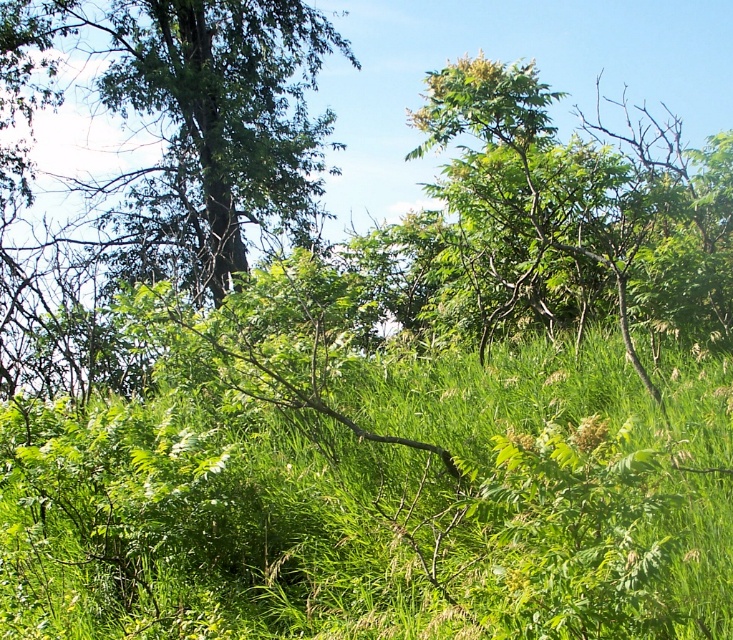
You are standing in a natural area with tall grasses and shrubs. You see a point marked at coordinates (377, 508). What is located at that point?

The point at (377, 508) is occupied by green leafy grass at center.

You are a gardener who wants to plant a new flower bed in the area shown in the image. The flower bed requires plants that are shorter than the existing green leafy tree at upper left. Can the green leafy grass at center be used for this flower bed?

The green leafy grass at center is much taller than the green leafy tree at upper left, so it cannot be used for the flower bed which requires plants shorter than the tree.

You are a hiker who wants to take a photo of the green leafy tree at upper left. However, you notice the green leafy grass at center is blocking your view. Can you move to the right side to get a clearer shot of the tree?

The green leafy grass at center is in front of the green leafy tree at upper left, so moving to the right side might help you position yourself behind the grass to get a clearer view of the tree.